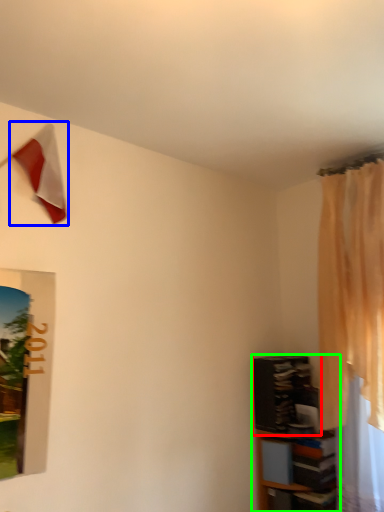
Question: Based on their relative distances, which object is farther from shelf (highlighted by a red box)? Choose from flag (highlighted by a blue box) and shelf (highlighted by a green box).

Choices:
 (A) flag
 (B) shelf

Answer: (A)